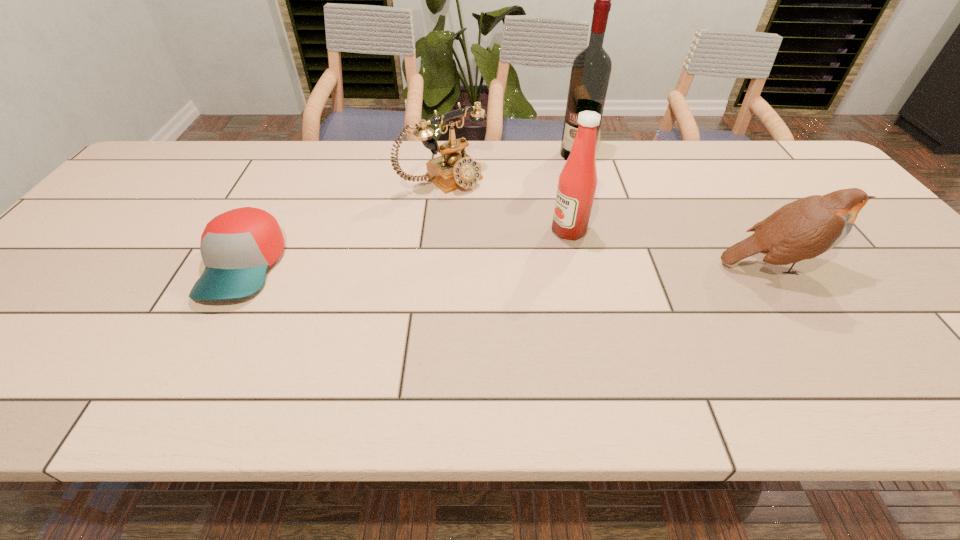
The width and height of the screenshot is (960, 540). I want to click on free space between the baseball cap and the condiment, so click(x=406, y=248).

You are a GUI agent. You are given a task and a screenshot of the screen. Output one action in this format:
    pyautogui.click(x=<x>, y=<y>)
    Task: Click on the free area in between the alcohol and the rightmost object
    
    Given the screenshot: What is the action you would take?
    pyautogui.click(x=675, y=210)

I want to click on empty space that is in between the rightmost object and the leftmost object, so click(x=508, y=266).

This screenshot has height=540, width=960. I want to click on empty space between the telephone and the leftmost object, so click(344, 222).

Identify which object is located as the nearest to the second tallest object. Please provide its 2D coordinates. Your answer should be formatted as a tuple, i.e. [(x, y)], where the tuple contains the x and y coordinates of a point satisfying the conditions above.

[(454, 169)]

The image size is (960, 540). Identify the location of the second closest object to the shortest object. (577, 183).

I want to click on vacant space that satisfies the following two spatial constraints: 1. on the front side of the rightmost object; 2. at the face of the telephone, so click(435, 265).

Image resolution: width=960 pixels, height=540 pixels. Identify the location of free space in the image that satisfies the following two spatial constraints: 1. on the front side of the second object from left to right; 2. at the face of the rightmost object. (435, 265).